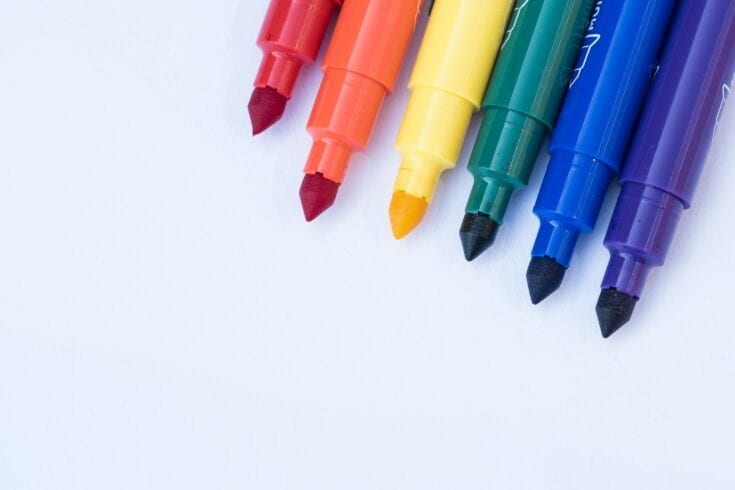
Identify the location of markers. The width and height of the screenshot is (735, 490). (287, 35), (375, 51), (459, 56), (537, 79), (586, 90), (675, 136).